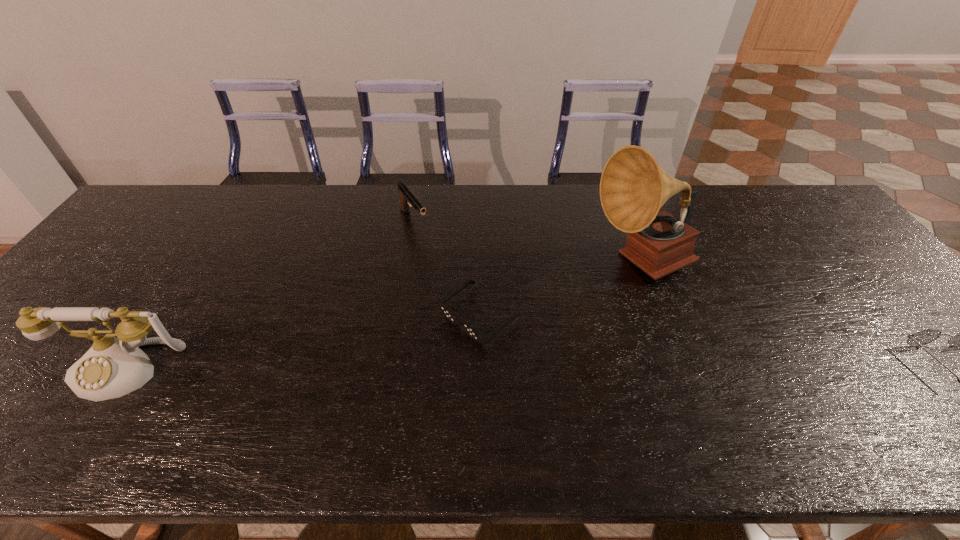
Locate an element on the screen. The width and height of the screenshot is (960, 540). vacant space located at the muzzle of the pistol is located at coordinates (435, 254).

Find the location of a particular element. The height and width of the screenshot is (540, 960). vacant space located 0.350m on the horn of the phonograph record is located at coordinates (556, 378).

I want to click on free space located on the horn of the phonograph record, so click(591, 327).

The width and height of the screenshot is (960, 540). I want to click on vacant space situated on the horn of the phonograph record, so point(554,381).

Locate an element on the screen. This screenshot has width=960, height=540. blank space located 0.130m on the front-facing side of the sunglasses is located at coordinates (409, 374).

Find the location of a particular element. This screenshot has width=960, height=540. free region located on the front-facing side of the sunglasses is located at coordinates (428, 358).

Image resolution: width=960 pixels, height=540 pixels. I want to click on free space located on the front-facing side of the sunglasses, so click(376, 400).

Locate an element on the screen. This screenshot has width=960, height=540. object that is positioned at the far edge is located at coordinates (407, 198).

You are a GUI agent. You are given a task and a screenshot of the screen. Output one action in this format:
    pyautogui.click(x=<x>, y=<y>)
    Task: Click on the object positioned at the near edge
    Image resolution: width=960 pixels, height=540 pixels.
    Given the screenshot: What is the action you would take?
    pyautogui.click(x=113, y=367)

Find the location of a particular element. The height and width of the screenshot is (540, 960). object that is at the left edge is located at coordinates (113, 367).